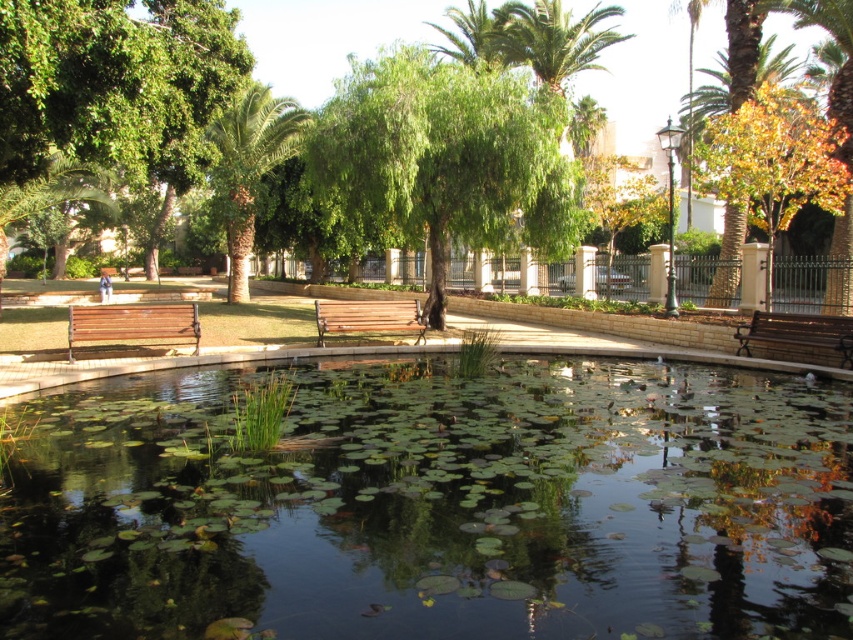
Question: Which point is farther to the camera?

Choices:
 (A) green leafy palm tree at upper left
 (B) wooden bench at center
 (C) wooden bench at right

Answer: (A)

Question: Which point is closer to the camera?

Choices:
 (A) green leafy tree at center
 (B) wooden bench at center
 (C) wooden bench at left

Answer: (C)

Question: Does green leafy palm tree at upper left appear under wooden bench at center?

Choices:
 (A) no
 (B) yes

Answer: (A)

Question: From the image, what is the correct spatial relationship of green leafy palm tree at upper left in relation to wooden bench at center?

Choices:
 (A) above
 (B) below

Answer: (A)

Question: Can you confirm if green leafy tree at center is thinner than wooden bench at right?

Choices:
 (A) no
 (B) yes

Answer: (A)

Question: Which object is farther from the camera taking this photo?

Choices:
 (A) green leafy tree at center
 (B) wooden bench at center

Answer: (A)